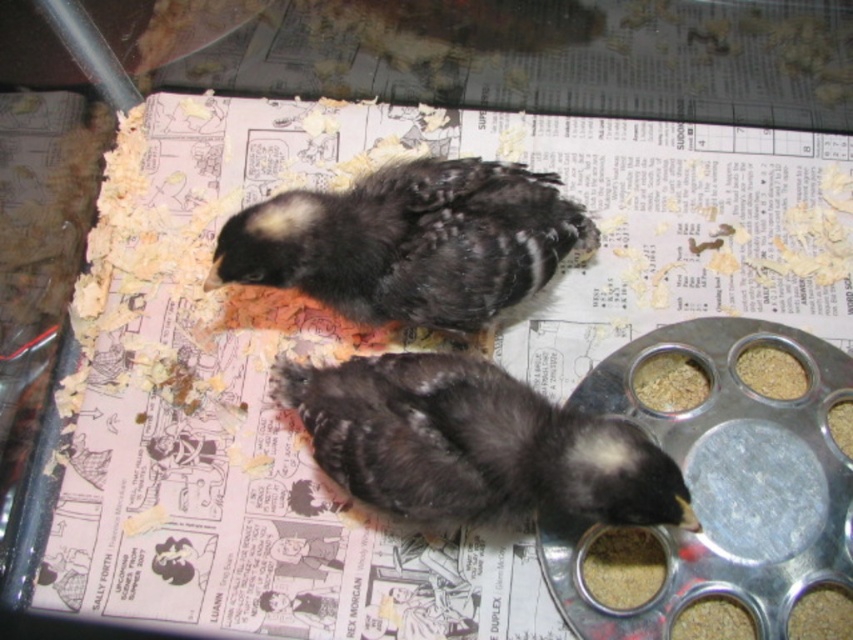
Question: Which object is positioned closest to the black matte chick at upper center?

Choices:
 (A) dark gray fluffy chick at center
 (B) brown grain at right

Answer: (A)

Question: Which point is farther to the camera?

Choices:
 (A) (396, 300)
 (B) (474, 426)

Answer: (A)

Question: Does dark gray fluffy chick at center come behind brown crumbly food at right?

Choices:
 (A) no
 (B) yes

Answer: (A)

Question: Does dark gray fluffy chick at center appear on the right side of brown grain at right?

Choices:
 (A) yes
 (B) no

Answer: (B)

Question: Which of the following is the closest to the observer?

Choices:
 (A) dark gray fluffy chick at center
 (B) brown crumbly food at right
 (C) black matte chick at upper center

Answer: (A)

Question: Does dark gray fluffy chick at center appear over brown crumbly food at right?

Choices:
 (A) yes
 (B) no

Answer: (B)